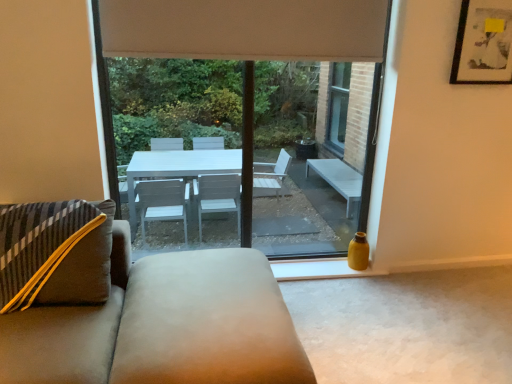
Measure the distance between point (478,51) and camera.

A distance of 8.59 feet exists between point (478,51) and camera.

What is the approximate width of transparent glass window at center?

It is 7.23 centimeters.

Locate an element on the screen. beige fabric curtain at upper center is located at coordinates (245, 29).

From the image's perspective, is suede ottoman at center located beneath matte black picture frame at upper right?

Yes, from the image's perspective, suede ottoman at center is beneath matte black picture frame at upper right.

Considering the relative sizes of suede ottoman at center and matte black picture frame at upper right in the image provided, is suede ottoman at center shorter than matte black picture frame at upper right?

→ Indeed, suede ottoman at center has a lesser height compared to matte black picture frame at upper right.

From a real-world perspective, is suede ottoman at center on top of matte black picture frame at upper right?

Incorrect, from a real-world perspective, suede ottoman at center is lower than matte black picture frame at upper right.

The image size is (512, 384). I want to click on curtain located above the matte black picture frame at upper right (from a real-world perspective), so click(x=245, y=29).

Can you confirm if beige fabric curtain at upper center is thinner than matte black picture frame at upper right?

No, beige fabric curtain at upper center is not thinner than matte black picture frame at upper right.

Is beige fabric curtain at upper center positioned behind matte black picture frame at upper right?

That is False.

Which object is wider, suede ottoman at center or transparent glass window at center?

With larger width is suede ottoman at center.

The height and width of the screenshot is (384, 512). Identify the location of window behind the suede ottoman at center. tap(254, 111).

From the picture: From the image's perspective, is suede ottoman at center located beneath transparent glass window at center?

Indeed, from the image's perspective, suede ottoman at center is shown beneath transparent glass window at center.

Which is closer, (208, 324) or (311, 23)?

Point (208, 324)

Is matte black picture frame at upper right beside beige fabric curtain at upper center?

No, matte black picture frame at upper right is not with beige fabric curtain at upper center.

Considering the sizes of matte black picture frame at upper right and beige fabric curtain at upper center in the image, is matte black picture frame at upper right wider or thinner than beige fabric curtain at upper center?

In the image, matte black picture frame at upper right appears to be more narrow than beige fabric curtain at upper center.

From a real-world perspective, is matte black picture frame at upper right physically above beige fabric curtain at upper center?

No, from a real-world perspective, matte black picture frame at upper right is not on top of beige fabric curtain at upper center.

Could you tell me if matte black picture frame at upper right is facing beige fabric curtain at upper center?

No, matte black picture frame at upper right is not turned towards beige fabric curtain at upper center.

Based on the photo, how many degrees apart are the facing directions of beige fabric curtain at upper center and transparent glass window at center?

beige fabric curtain at upper center and transparent glass window at center are facing 0.206 degrees away from each other.

Considering their positions, is beige fabric curtain at upper center located in front of or behind transparent glass window at center?

Clearly, beige fabric curtain at upper center is in front of transparent glass window at center.

Between beige fabric curtain at upper center and transparent glass window at center, which one has more height?

With more height is transparent glass window at center.

How many degrees apart are the facing directions of matte black picture frame at upper right and transparent glass window at center?

The facing directions of matte black picture frame at upper right and transparent glass window at center are 0.767 degrees apart.

The height and width of the screenshot is (384, 512). Find the location of `window that is on the left side of matte black picture frame at upper right`. window that is on the left side of matte black picture frame at upper right is located at coordinates (254, 111).

Between matte black picture frame at upper right and transparent glass window at center, which one has larger size?

With larger size is transparent glass window at center.

How many degrees apart are the facing directions of transparent glass window at center and beige fabric curtain at upper center?

They differ by 0.206 degrees in their facing directions.

Is transparent glass window at center aimed at beige fabric curtain at upper center?

Yes, transparent glass window at center is oriented towards beige fabric curtain at upper center.

Who is shorter, transparent glass window at center or beige fabric curtain at upper center?

With less height is beige fabric curtain at upper center.

Can you confirm if transparent glass window at center is smaller than beige fabric curtain at upper center?

Incorrect, transparent glass window at center is not smaller in size than beige fabric curtain at upper center.

Where is `flat on the left of matte black picture frame at upper right`? flat on the left of matte black picture frame at upper right is located at coordinates (207, 322).

Identify the location of picture frame on the right side of beige fabric curtain at upper center. This screenshot has height=384, width=512. (483, 43).

Based on the photo, which object lies further to the anchor point suede ottoman at center, transparent glass window at center or beige fabric curtain at upper center?

Among the two, transparent glass window at center is located further to suede ottoman at center.

Which object lies further to the anchor point matte black picture frame at upper right, transparent glass window at center or suede ottoman at center?

transparent glass window at center is positioned further to the anchor matte black picture frame at upper right.

Considering their positions, is beige fabric curtain at upper center positioned closer to matte black picture frame at upper right than suede ottoman at center?

beige fabric curtain at upper center is positioned closer to the anchor matte black picture frame at upper right.

Estimate the real-world distances between objects in this image. Which object is further from beige fabric curtain at upper center, transparent glass window at center or suede ottoman at center?

transparent glass window at center.

Which object lies further to the anchor point beige fabric curtain at upper center, suede ottoman at center or transparent glass window at center?

transparent glass window at center is further to beige fabric curtain at upper center.

When comparing their distances from suede ottoman at center, does beige fabric curtain at upper center or transparent glass window at center seem closer?

beige fabric curtain at upper center lies closer to suede ottoman at center than the other object.

Which object lies nearer to the anchor point suede ottoman at center, transparent glass window at center or matte black picture frame at upper right?

matte black picture frame at upper right is closer to suede ottoman at center.

When comparing their distances from transparent glass window at center, does suede ottoman at center or beige fabric curtain at upper center seem further?

suede ottoman at center is further to transparent glass window at center.

Find the location of a particular element. The height and width of the screenshot is (384, 512). picture frame between beige fabric curtain at upper center and suede ottoman at center from top to bottom is located at coordinates (483, 43).

The image size is (512, 384). I want to click on curtain between transparent glass window at center and matte black picture frame at upper right, so click(x=245, y=29).

Locate an element on the screen. window between beige fabric curtain at upper center and suede ottoman at center vertically is located at coordinates (254, 111).

Find the location of a particular element. window between suede ottoman at center and matte black picture frame at upper right is located at coordinates (254, 111).